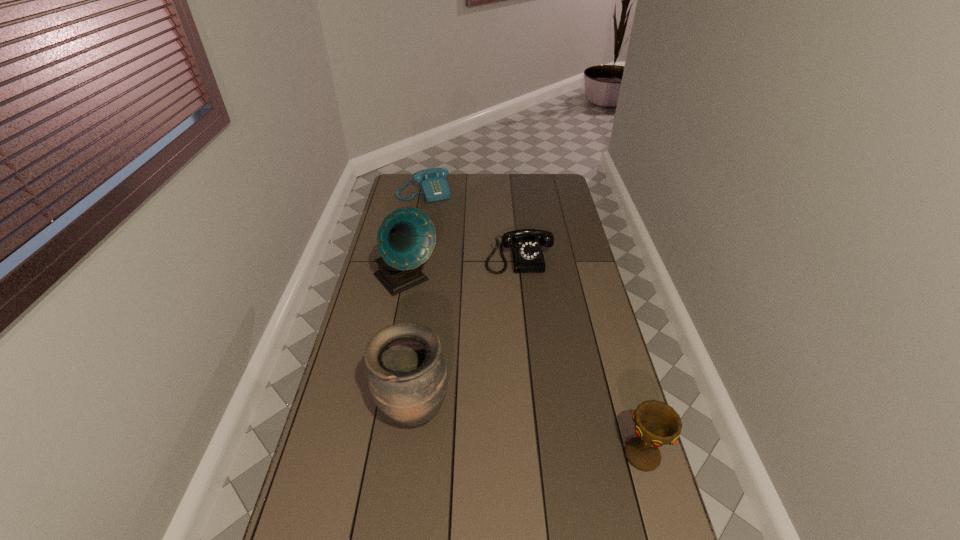
I want to click on free space between the urn and the rightmost object, so click(529, 434).

At what (x,y) coordinates should I click in order to perform the action: click on unoccupied position between the taller telephone and the tallest object. Please return your answer as a coordinate pair (x, y). This screenshot has width=960, height=540. Looking at the image, I should click on (462, 269).

The width and height of the screenshot is (960, 540). Identify the location of blank region between the chalice and the right telephone. (581, 356).

Where is `vacant point located between the second tallest object and the third tallest object`? The height and width of the screenshot is (540, 960). vacant point located between the second tallest object and the third tallest object is located at coordinates (529, 434).

Locate an element on the screen. vacant area that lies between the chalice and the phonograph_record is located at coordinates (524, 368).

Find the location of a particular element. free spot between the nearer telephone and the third shortest object is located at coordinates (581, 356).

This screenshot has width=960, height=540. I want to click on free space between the phonograph_record and the taller telephone, so click(x=462, y=269).

Find the location of a particular element. This screenshot has height=540, width=960. empty space that is in between the tallest object and the rightmost object is located at coordinates (524, 368).

This screenshot has height=540, width=960. I want to click on object that stands as the closest to the urn, so click(x=406, y=238).

Find the location of `the second closest object relative to the phonograph_record`. the second closest object relative to the phonograph_record is located at coordinates (407, 375).